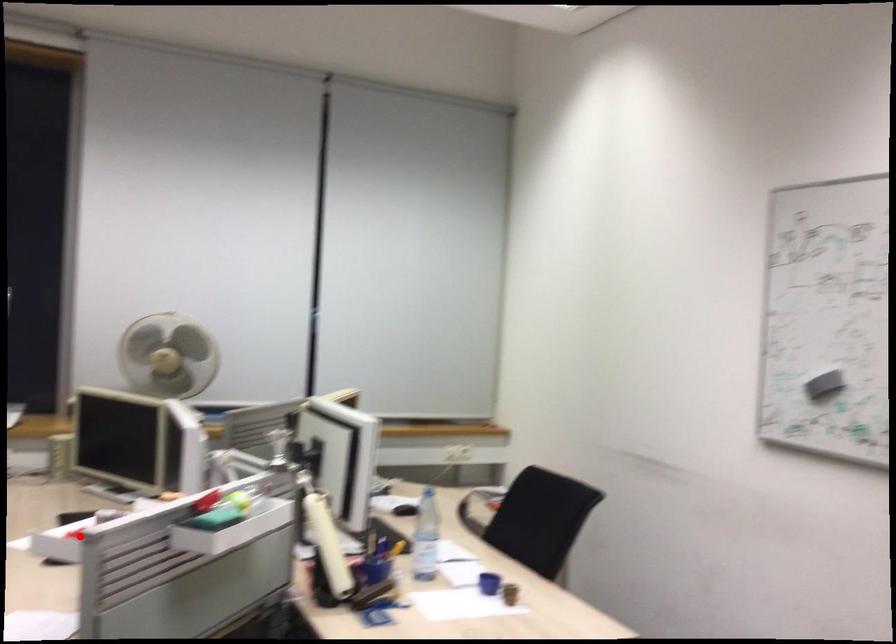
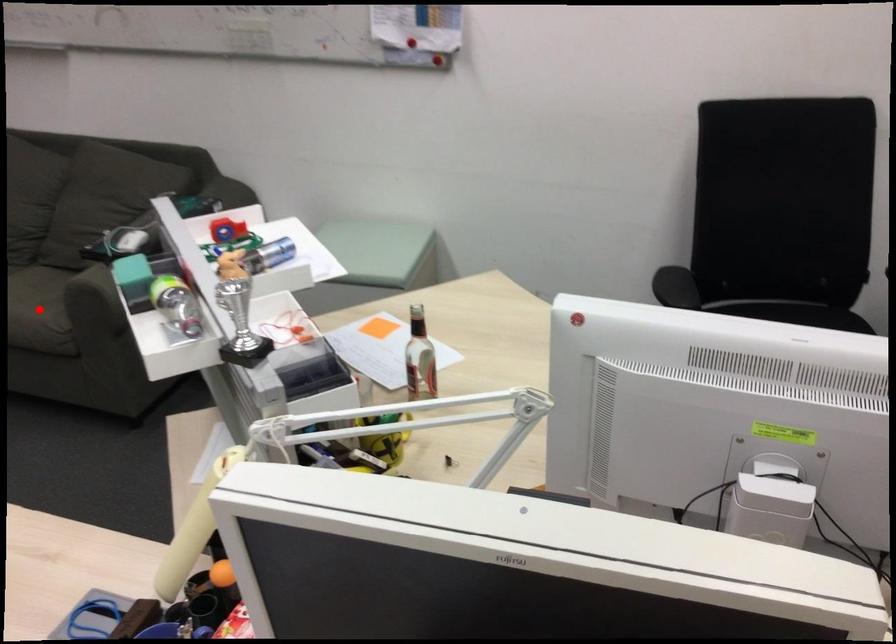
I am providing you with two images of the same scene from different viewpoints. A red point is marked on the first image and another point is marked on the second image. Do the highlighted points in image1 and image2 indicate the same real-world spot?

No